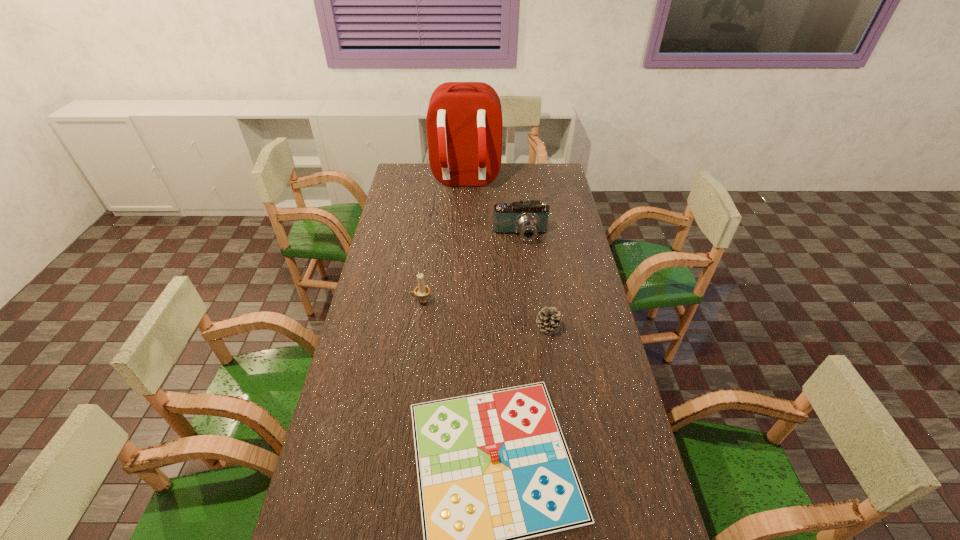
Identify the location of vacant space that satisfies the following two spatial constraints: 1. on the front-facing side of the camcorder; 2. on the left side of the second nearest object. (531, 327).

The width and height of the screenshot is (960, 540). I want to click on vacant point that satisfies the following two spatial constraints: 1. on the front-facing side of the camcorder; 2. on the handle side of the third nearest object, so click(x=528, y=301).

Where is `vacant space that satisfies the following two spatial constraints: 1. on the handle side of the third farthest object; 2. on the left side of the fourth farthest object`? The height and width of the screenshot is (540, 960). vacant space that satisfies the following two spatial constraints: 1. on the handle side of the third farthest object; 2. on the left side of the fourth farthest object is located at coordinates (418, 327).

Locate an element on the screen. vacant area in the image that satisfies the following two spatial constraints: 1. on the handle side of the fourth farthest object; 2. on the left side of the third nearest object is located at coordinates (418, 327).

Identify the location of vacant area that satisfies the following two spatial constraints: 1. on the front-facing side of the second nearest object; 2. on the right side of the camcorder. (531, 327).

The image size is (960, 540). I want to click on vacant space that satisfies the following two spatial constraints: 1. on the front-facing side of the fourth nearest object; 2. on the left side of the fourth tallest object, so click(531, 327).